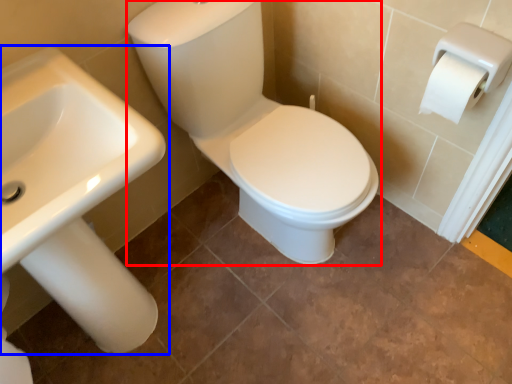
Question: Which object is closer to the camera taking this photo, sit (highlighted by a red box) or sink (highlighted by a blue box)?

Choices:
 (A) sit
 (B) sink

Answer: (B)